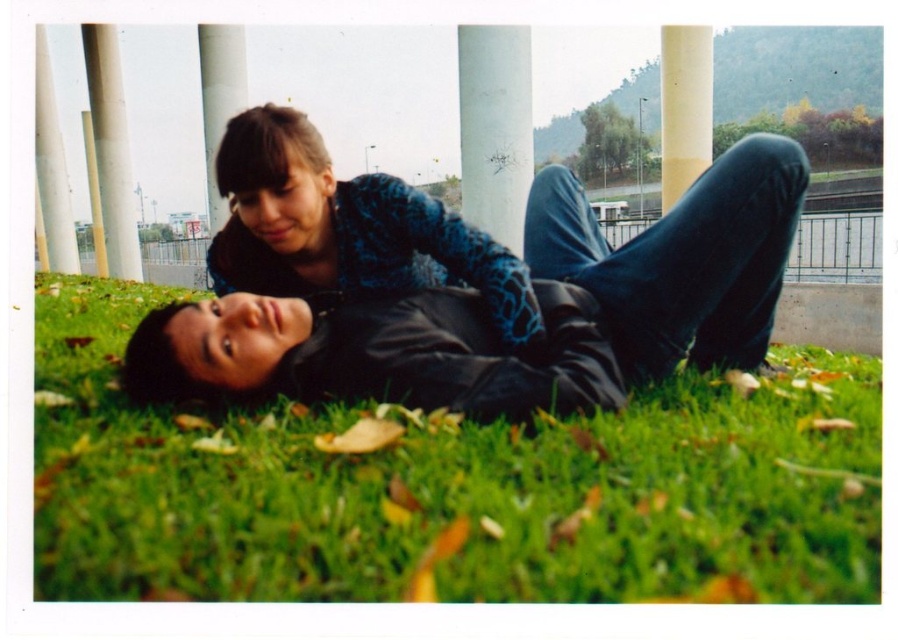
Can you confirm if green grass at center is shorter than white matte pillar at center?

Indeed, green grass at center has a lesser height compared to white matte pillar at center.

Is green grass at center to the right of white matte pillar at center from the viewer's perspective?

Correct, you'll find green grass at center to the right of white matte pillar at center.

Which is behind, point (234, 572) or point (505, 125)?

The point (505, 125) is more distant.

The height and width of the screenshot is (640, 898). I want to click on green grass at center, so click(x=449, y=486).

What do you see at coordinates (497, 326) in the screenshot? I see `black leather jacket at lower left` at bounding box center [497, 326].

What are the coordinates of `black leather jacket at lower left` in the screenshot? It's located at (497, 326).

Who is positioned more to the right, green grass at center or white concrete pillar at upper left?

Positioned to the right is green grass at center.

Between green grass at center and white concrete pillar at upper left, which one is positioned higher?

white concrete pillar at upper left

Measure the distance between green grass at center and camera.

The distance of green grass at center from camera is 2.20 meters.

You are a GUI agent. You are given a task and a screenshot of the screen. Output one action in this format:
    pyautogui.click(x=<x>, y=<y>)
    Task: Click on the green grass at center
    This screenshot has width=898, height=640.
    Given the screenshot: What is the action you would take?
    pyautogui.click(x=449, y=486)